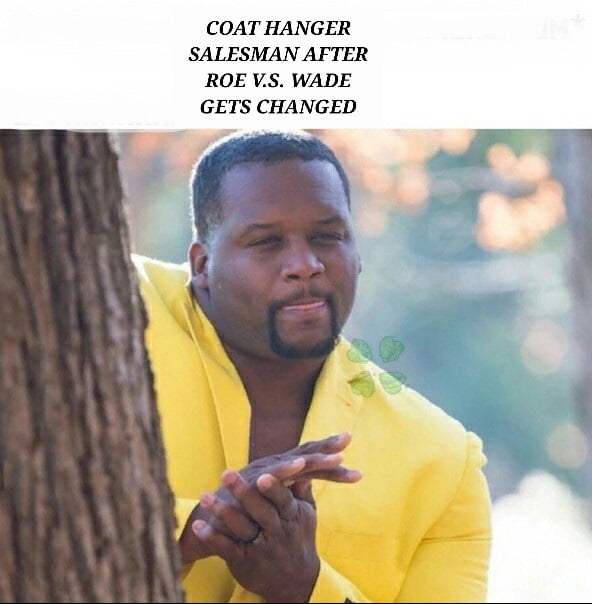
Locate an element on the screen. This screenshot has width=592, height=604. coat hanger is located at coordinates (268, 25).